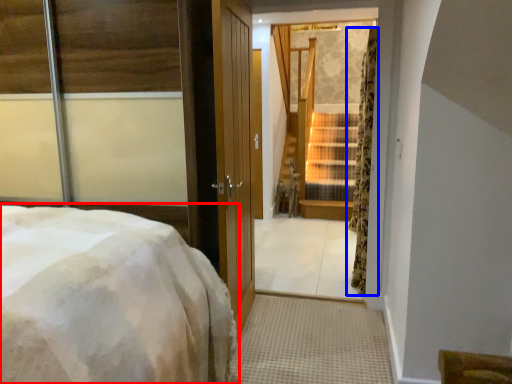
Question: Which point is further to the camera, bed (highlighted by a red box) or curtain (highlighted by a blue box)?

Choices:
 (A) bed
 (B) curtain

Answer: (B)